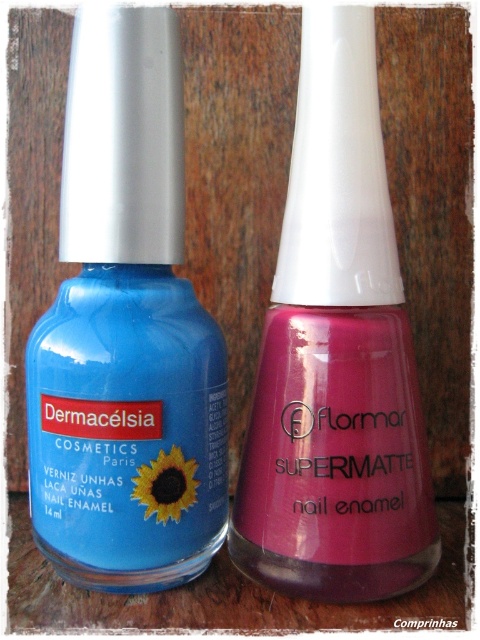
Is matte blue nail enamel at left thinner than matte pink nail enamel at center?

Indeed, matte blue nail enamel at left has a lesser width compared to matte pink nail enamel at center.

Can you confirm if matte blue nail enamel at left is positioned above matte pink nail enamel at center?

Incorrect, matte blue nail enamel at left is not positioned above matte pink nail enamel at center.

Does point (144, 524) come closer to viewer compared to point (355, 61)?

That is True.

The width and height of the screenshot is (480, 640). I want to click on matte blue nail enamel at left, so click(126, 332).